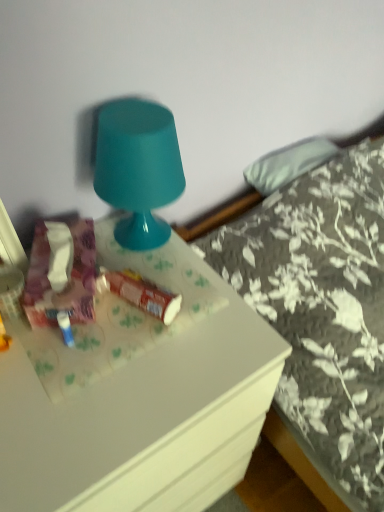
Locate an element on the screen. free point above glossy plastic lamp at upper center (from a real-world perspective) is located at coordinates (135, 114).